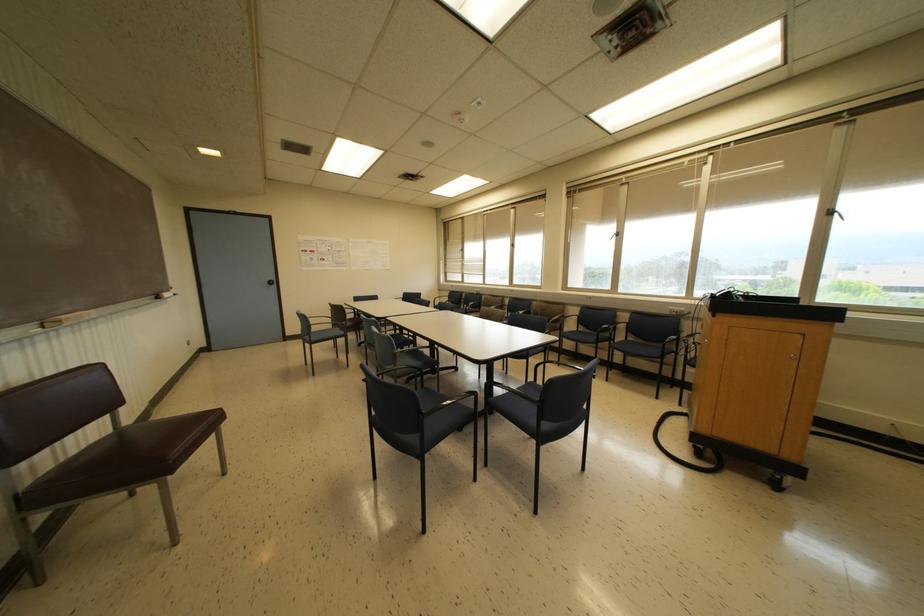
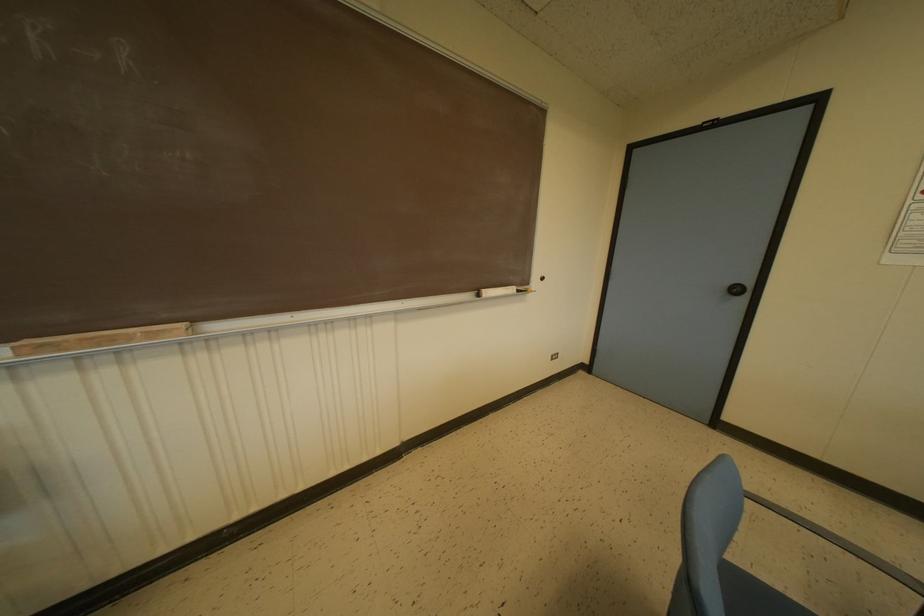
Where in the second image is the point corresponding to point (166, 294) from the first image?

(487, 292)